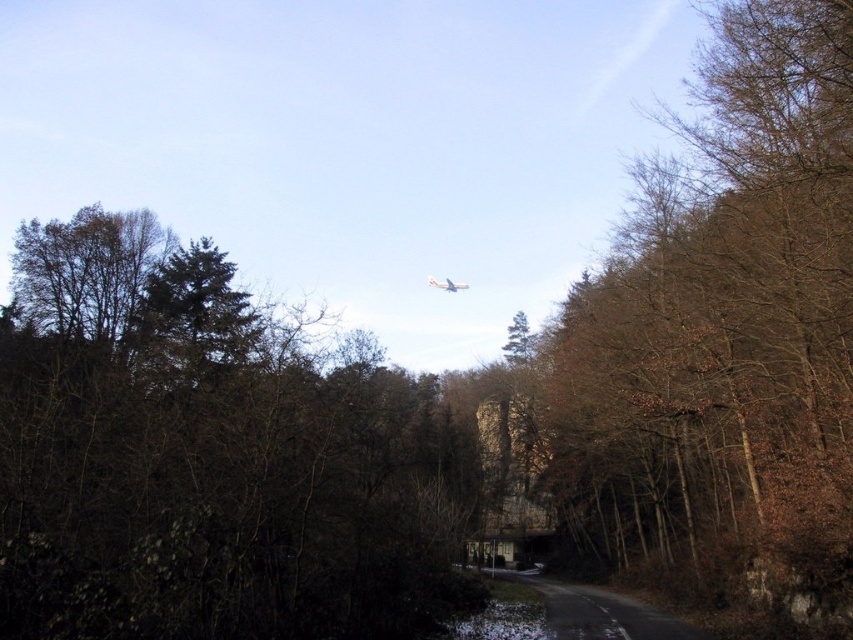
Question: Which point is farther from the camera taking this photo?

Choices:
 (A) (355, 596)
 (B) (456, 285)

Answer: (B)

Question: Does brown leafy tree at center have a greater width compared to white glossy airplane at center?

Choices:
 (A) no
 (B) yes

Answer: (B)

Question: Is brown leafy tree at upper center to the left of white glossy airplane at center from the viewer's perspective?

Choices:
 (A) yes
 (B) no

Answer: (A)

Question: Is brown leafy tree at center wider than white glossy airplane at center?

Choices:
 (A) no
 (B) yes

Answer: (B)

Question: Which point is farther to the camera?

Choices:
 (A) (447, 284)
 (B) (253, 388)

Answer: (A)

Question: Among these points, which one is nearest to the camera?

Choices:
 (A) (708, 280)
 (B) (453, 284)

Answer: (A)